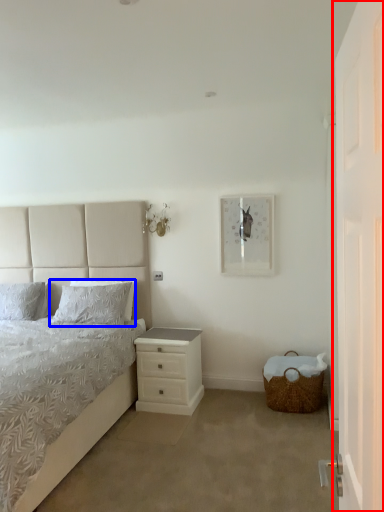
Question: Which object is closer to the camera taking this photo, door (highlighted by a red box) or pillow (highlighted by a blue box)?

Choices:
 (A) door
 (B) pillow

Answer: (A)